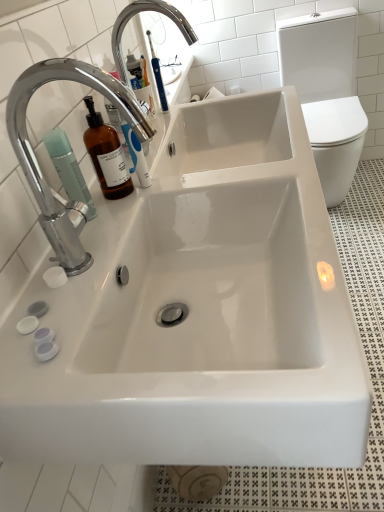
Where is `vacant area that is in front of chrome/metallic faucet at upper left, acting as the second tap starting from the top`? This screenshot has height=512, width=384. vacant area that is in front of chrome/metallic faucet at upper left, acting as the second tap starting from the top is located at coordinates (84, 321).